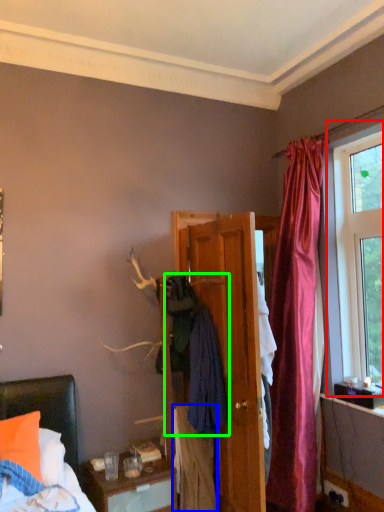
Question: Which object is the closest to the window (highlighted by a red box)? Choose among these: clothing (highlighted by a blue box) or clothing (highlighted by a green box).

Choices:
 (A) clothing
 (B) clothing

Answer: (B)